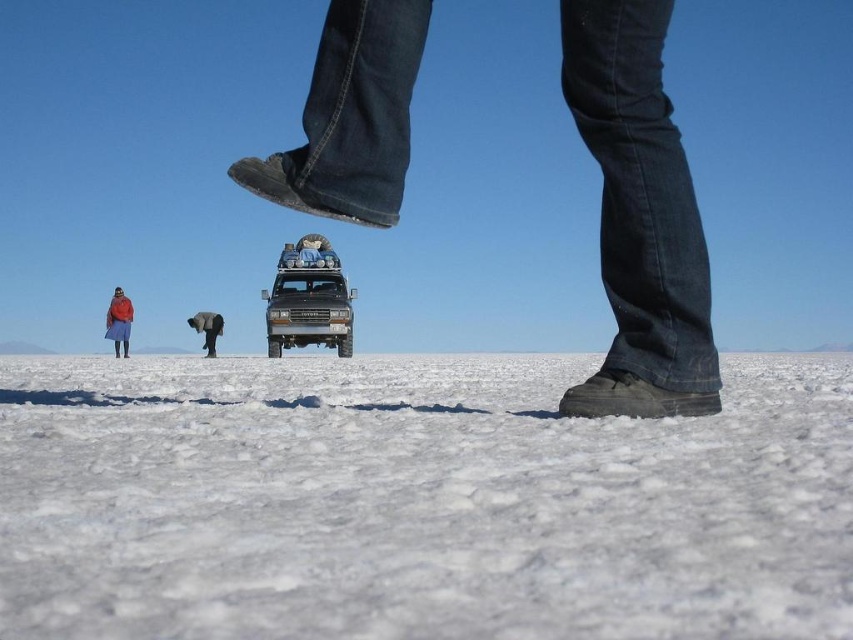
Question: Does denim jeans at upper center have a smaller size compared to red wool sweater at lower left?

Choices:
 (A) no
 (B) yes

Answer: (B)

Question: Among these points, which one is farthest from the camera?

Choices:
 (A) (312, 330)
 (B) (216, 332)
 (C) (117, 339)
 (D) (369, 204)

Answer: (B)

Question: Which is farther from the smooth gray elephant at center?

Choices:
 (A) white crystalline snow at lower center
 (B) red wool sweater at lower left
 (C) matte black jeep at center

Answer: (A)

Question: Does white crystalline snow at lower center appear over denim jeans at upper center?

Choices:
 (A) yes
 (B) no

Answer: (B)

Question: Which is farther from the matte black jeep at center?

Choices:
 (A) red wool sweater at lower left
 (B) smooth gray elephant at center
 (C) denim jeans at upper center

Answer: (C)

Question: Is white crystalline snow at lower center further to camera compared to red wool sweater at lower left?

Choices:
 (A) no
 (B) yes

Answer: (A)